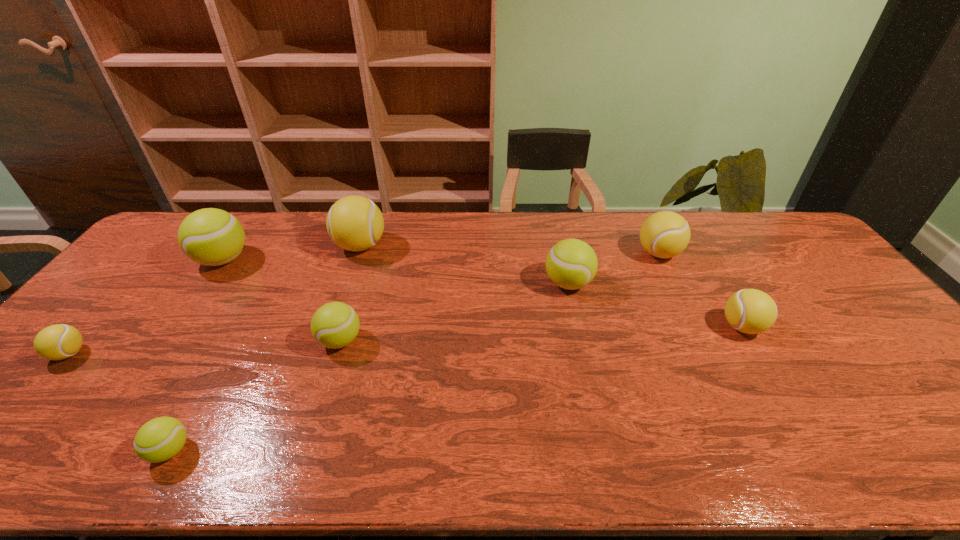
This screenshot has width=960, height=540. I want to click on free point between the third biggest yellow tennis ball and the third farthest green tennis ball, so pos(541,334).

Identify the location of free space between the sixth object from left to right and the third smallest yellow tennis ball. (613, 268).

Find the location of a particular element. The width and height of the screenshot is (960, 540). empty location between the third green tennis ball from left to right and the third smallest yellow tennis ball is located at coordinates (499, 297).

Locate an element on the screen. Image resolution: width=960 pixels, height=540 pixels. vacant space that is in between the leftmost object and the third smallest yellow tennis ball is located at coordinates (364, 303).

Identify the location of blank region between the second yellow tennis ball from left to right and the second green tennis ball from right to left. (350, 293).

Identify the location of free point between the nearest tennis ball and the second biggest yellow tennis ball. This screenshot has width=960, height=540. (415, 352).

Locate an element on the screen. The width and height of the screenshot is (960, 540). vacant area that lies between the second smallest yellow tennis ball and the rightmost green tennis ball is located at coordinates (655, 305).

Locate which object is the fourth closest to the leftmost object. Please provide its 2D coordinates. Your answer should be formatted as a tuple, i.e. [(x, y)], where the tuple contains the x and y coordinates of a point satisfying the conditions above.

[(355, 223)]

Choose which object is the third nearest neighbor to the third object from left to right. Please provide its 2D coordinates. Your answer should be formatted as a tuple, i.e. [(x, y)], where the tuple contains the x and y coordinates of a point satisfying the conditions above.

[(212, 237)]

What are the coordinates of `tennis ball identified as the sixth closest to the leftmost green tennis ball` in the screenshot? It's located at (665, 234).